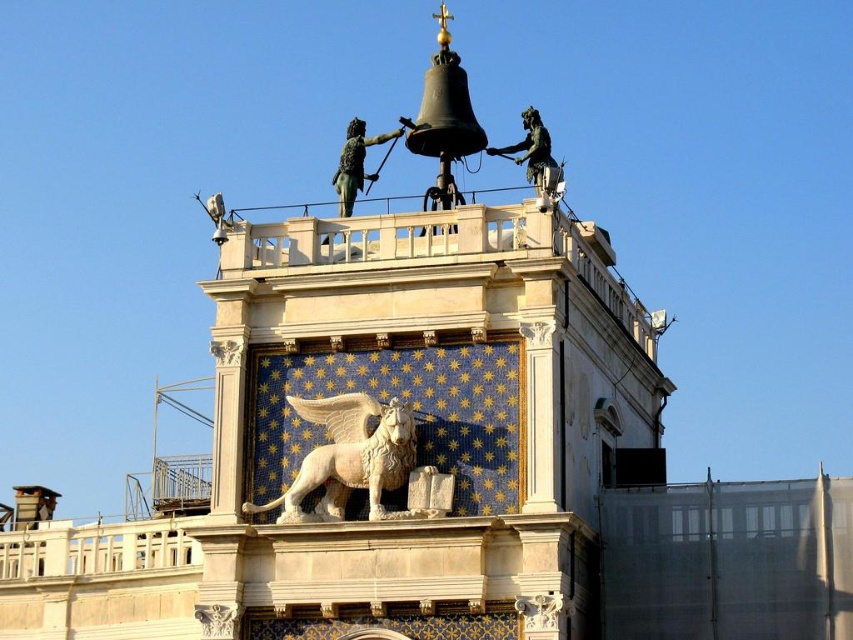
Which is behind, point (398, 486) or point (349, 148)?

Point (349, 148)

Who is more forward, [323,506] or [346,211]?

Point [323,506] is in front.

The image size is (853, 640). I want to click on white marble lion at center, so click(x=360, y=461).

Who is positioned more to the right, white marble lion at center or green patinated bronze statue at upper center?

Positioned to the right is green patinated bronze statue at upper center.

Between point (335, 500) and point (537, 172), which one is positioned behind?

The point (537, 172) is behind.

I want to click on white marble lion at center, so click(x=360, y=461).

Can you confirm if green polished bronze statue at upper center is positioned above green patinated bronze statue at upper center?

Correct, green polished bronze statue at upper center is located above green patinated bronze statue at upper center.

Is point (344, 172) closer to camera compared to point (538, 177)?

No, (344, 172) is behind (538, 177).

The width and height of the screenshot is (853, 640). I want to click on green polished bronze statue at upper center, so click(x=355, y=163).